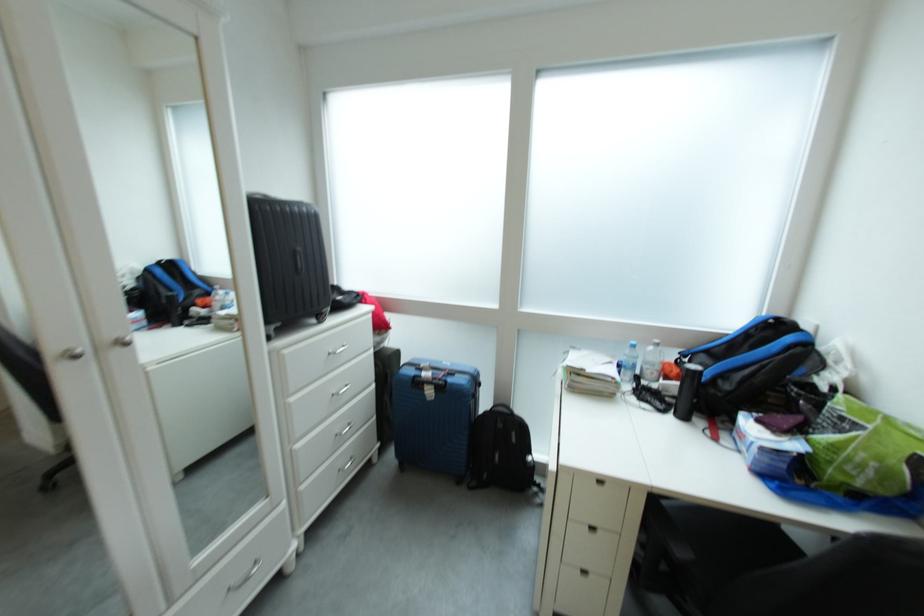
This screenshot has width=924, height=616. Describe the element at coordinates (431, 390) in the screenshot. I see `the blue suitcase handle` at that location.